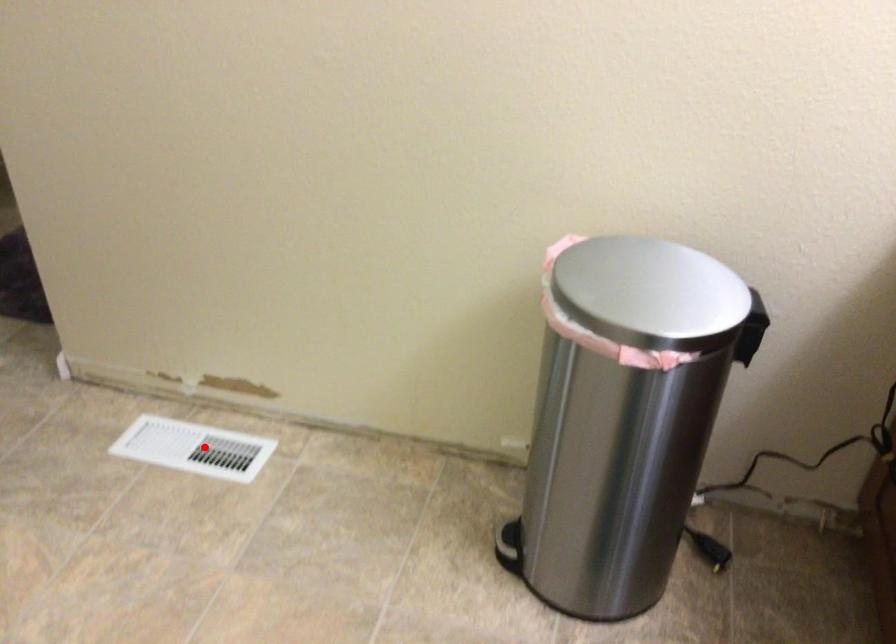
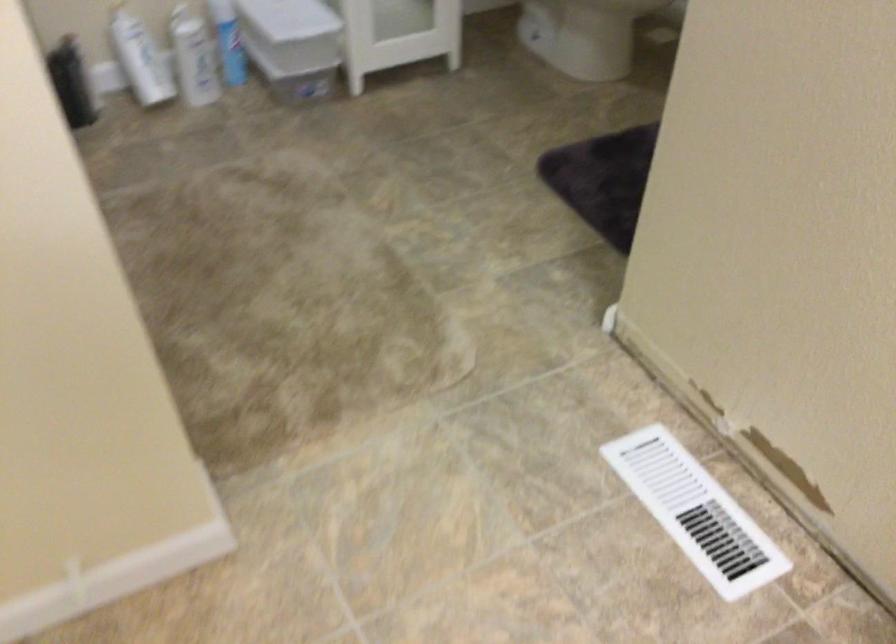
Question: I am providing you with two images of the same scene from different viewpoints. A red point is marked on the first image. Can you still see the location of the red point in image 2?

Choices:
 (A) Yes
 (B) No

Answer: (A)